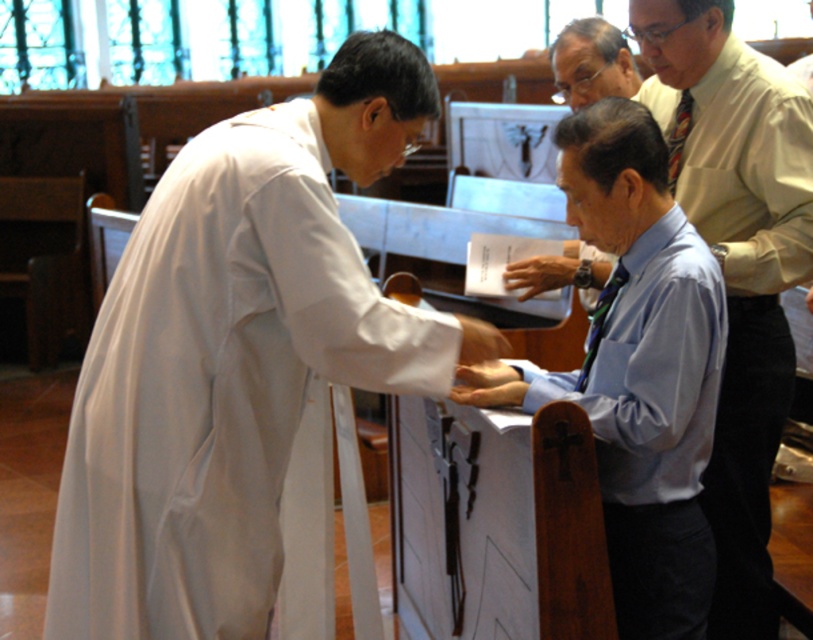
Question: Can you confirm if white matte/soft robe at center is positioned above white matte robe at lower center?

Choices:
 (A) yes
 (B) no

Answer: (A)

Question: Does white matte/soft robe at center appear on the left side of white matte robe at upper right?

Choices:
 (A) no
 (B) yes

Answer: (B)

Question: Among these objects, which one is nearest to the camera?

Choices:
 (A) white matte robe at lower center
 (B) white matte robe at upper right

Answer: (A)

Question: Which object appears farthest from the camera in this image?

Choices:
 (A) white matte robe at upper right
 (B) white matte robe at lower center
 (C) white matte/soft robe at center

Answer: (A)

Question: Can you confirm if white matte/soft robe at center is positioned above white matte robe at upper right?

Choices:
 (A) no
 (B) yes

Answer: (A)

Question: Which point appears closest to the camera in this image?

Choices:
 (A) (103, 445)
 (B) (642, 548)

Answer: (A)